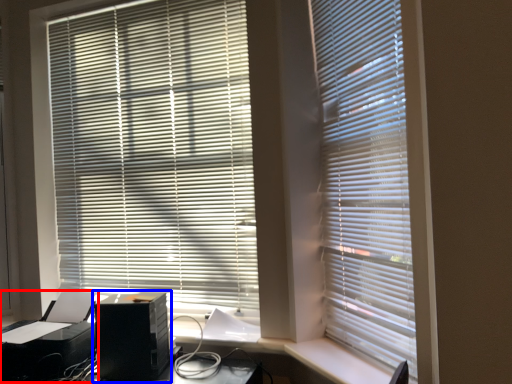
Question: Which point is closer to the camera, printer (highlighted by a red box) or computer tower (highlighted by a blue box)?

Choices:
 (A) printer
 (B) computer tower

Answer: (B)